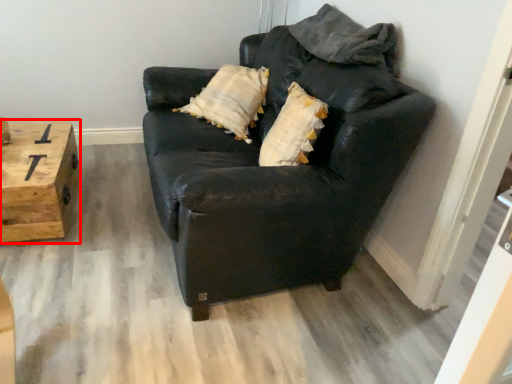
Question: In this image, where is table (annotated by the red box) located relative to studio couch?

Choices:
 (A) left
 (B) right

Answer: (A)